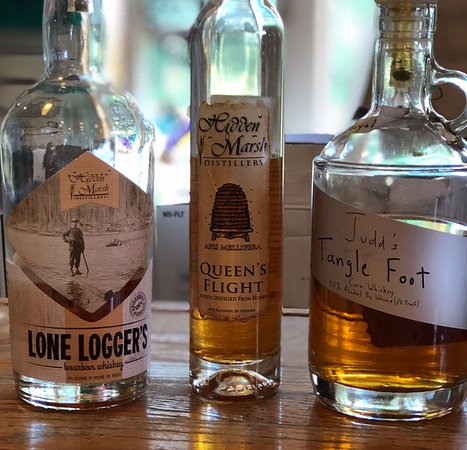
Where is `window`? The image size is (467, 450). window is located at coordinates (332, 73), (166, 92).